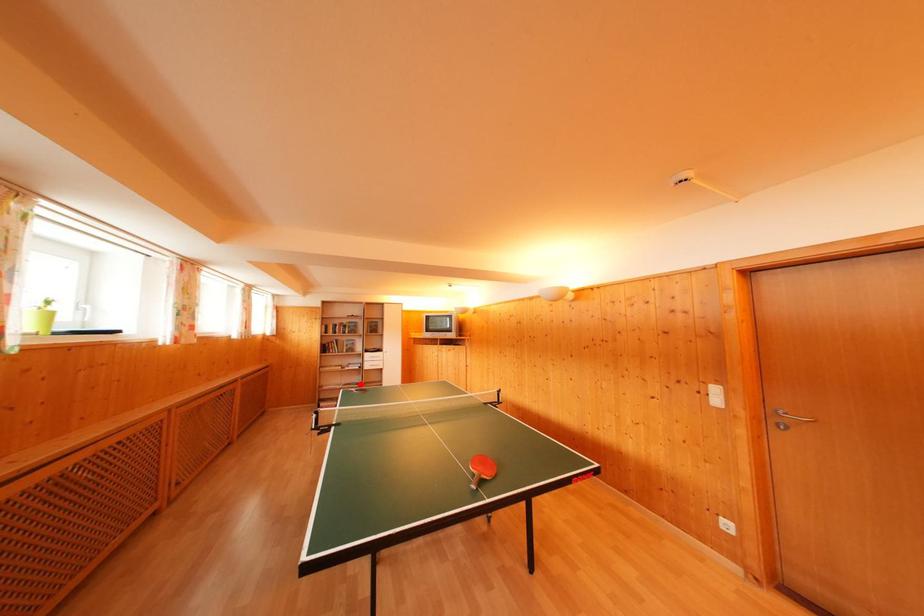
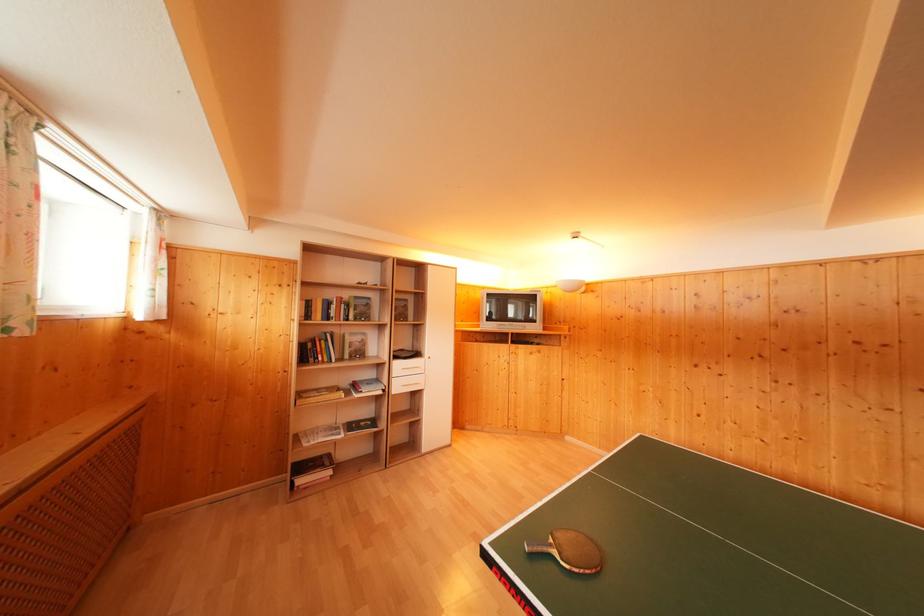
Question: I am providing you with two images of the same scene from different viewpoints. Image1 has a red point marked. In image2, the corresponding 3D location appears at what relative position? Reply with the corresponding letter.

Choices:
 (A) Closer
 (B) Farther

Answer: (B)